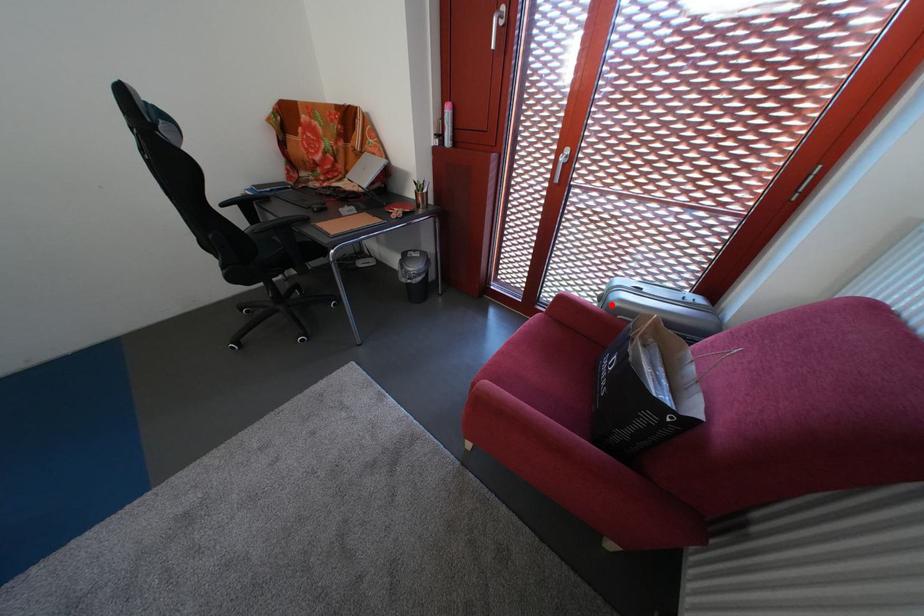
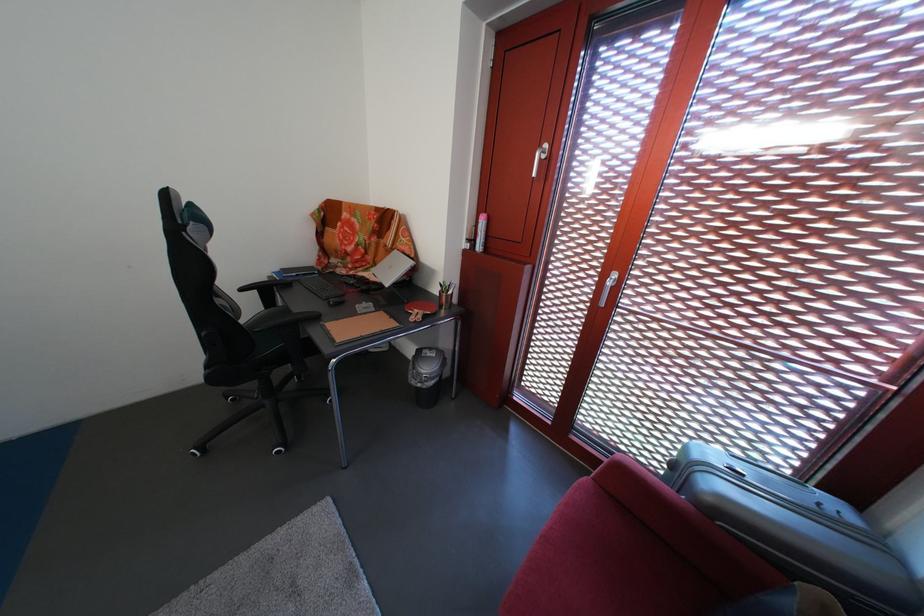
Locate, in the second image, the point that corresponds to the highlighted location in the first image.

(684, 472)